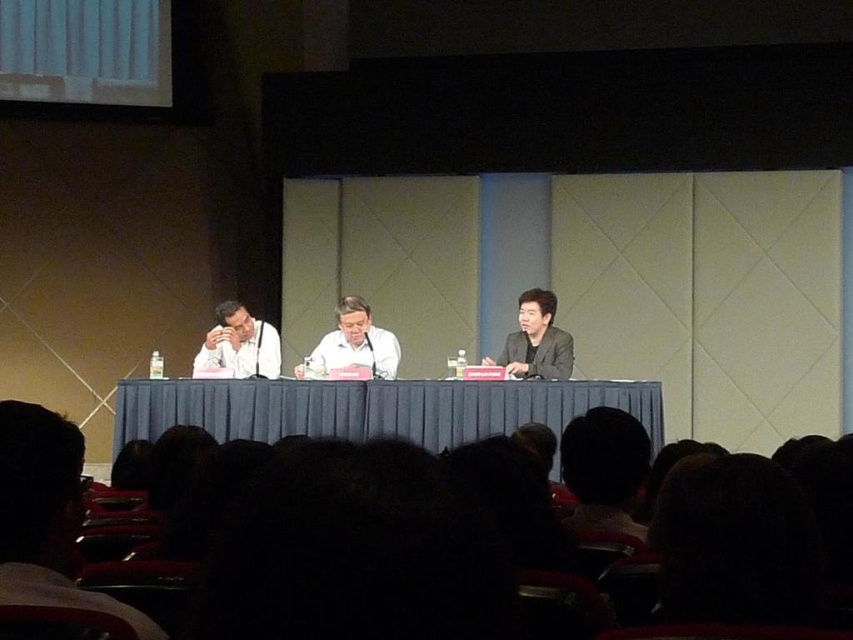
You are an event photographer positioned at the back of the room. You need to capture a clear photo of both the matte white shirt at left and the smooth white shirt at center on the stage. Considering their sizes in the frame, which shirt will appear smaller in the photo?

A: The matte white shirt at left occupies less space than the smooth white shirt at center, so it will appear smaller in the photo.